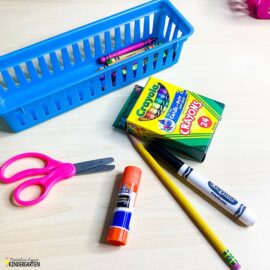
Where is `pink handled scissors`? The image size is (270, 270). pink handled scissors is located at coordinates (59, 170).